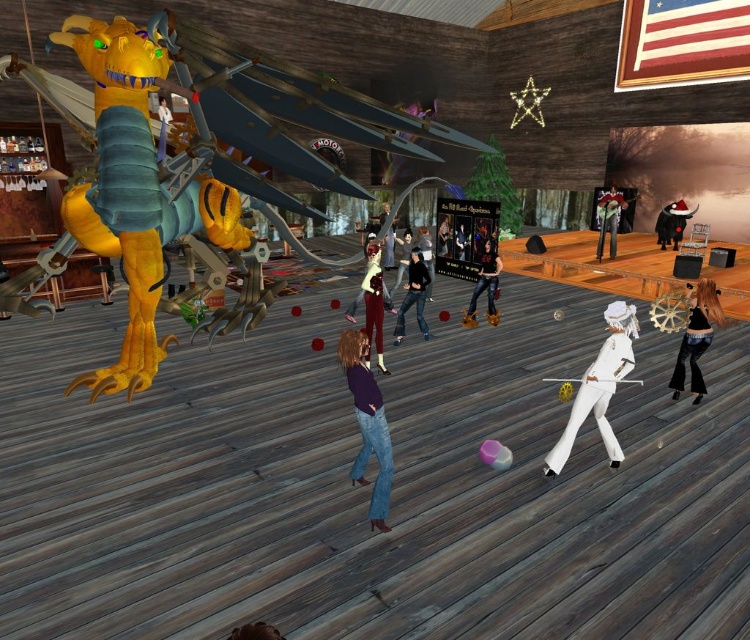
Question: Where is black santa hat at center located in relation to black leather jacket at center in the image?

Choices:
 (A) left
 (B) right

Answer: (B)

Question: Can you confirm if white glossy hat at center is positioned to the right of velvet maroon dress at center?

Choices:
 (A) no
 (B) yes

Answer: (B)

Question: Is black santa hat at center below matte white dress at center?

Choices:
 (A) yes
 (B) no

Answer: (B)

Question: Which of the following is the closest to the observer?

Choices:
 (A) shiny silver helmet at upper right
 (B) velvet maroon dress at center
 (C) smooth white shirt at center

Answer: (B)

Question: Considering the real-world distances, which object is closest to the black leather jacket at center?

Choices:
 (A) shiny black hair at center
 (B) matte white dress at center
 (C) smooth black jacket at center

Answer: (C)

Question: Which of the following is the closest to the observer?

Choices:
 (A) smooth black jacket at center
 (B) black santa hat at center

Answer: (A)